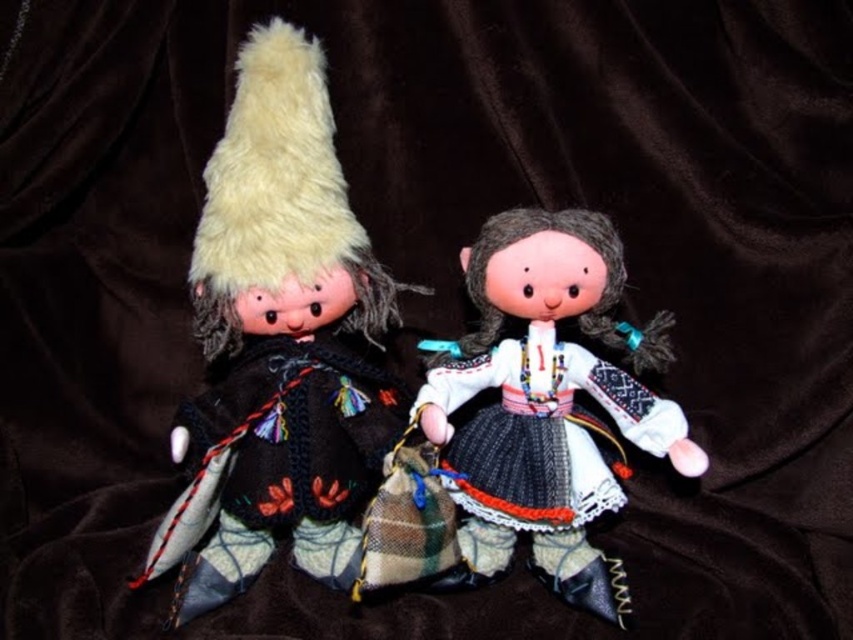
Question: Based on their relative distances, which object is farther from the knitted wool dress at center?

Choices:
 (A) fuzzy woolen hat at left
 (B) woolen sweater at left

Answer: (A)

Question: Is white fabric doll at center wider than knitted wool dress at center?

Choices:
 (A) no
 (B) yes

Answer: (B)

Question: Which of the following is the closest to the observer?

Choices:
 (A) fuzzy woolen hat at left
 (B) knitted wool dress at center
 (C) white fabric doll at center

Answer: (A)

Question: In this image, where is white fabric doll at center located relative to knitted wool dress at center?

Choices:
 (A) above
 (B) below

Answer: (A)

Question: Observing the image, what is the correct spatial positioning of fuzzy woolen hat at left in reference to knitted wool dress at center?

Choices:
 (A) above
 (B) below

Answer: (A)

Question: Which of the following is the farthest from the observer?

Choices:
 (A) (505, 481)
 (B) (431, 435)

Answer: (A)